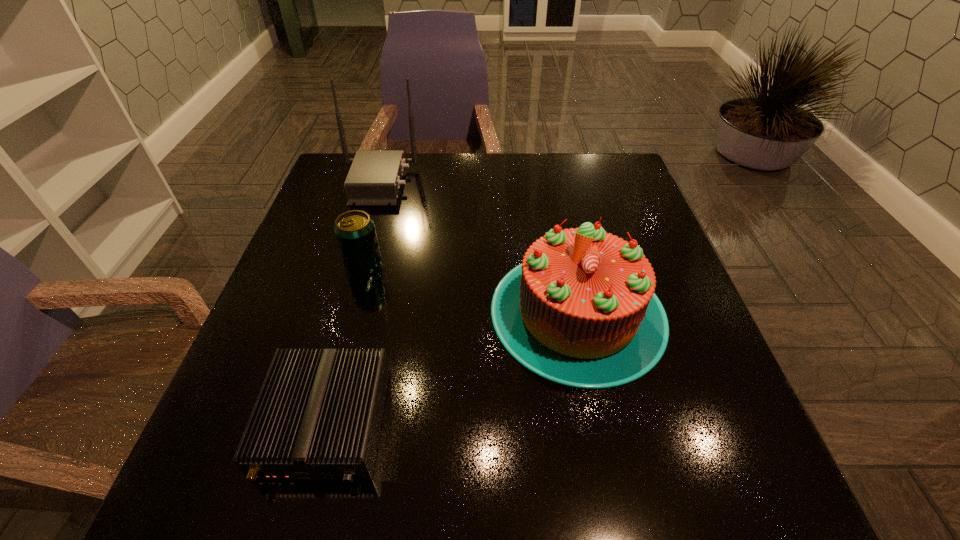
The height and width of the screenshot is (540, 960). Identify the location of the taller router. (374, 179).

Locate an element on the screen. The height and width of the screenshot is (540, 960). the farther router is located at coordinates (374, 179).

Identify the location of the rightmost object. (580, 310).

The image size is (960, 540). In order to click on cake in this screenshot , I will do `click(580, 310)`.

Where is `beer can`? beer can is located at coordinates (355, 232).

I want to click on the shortest object, so click(318, 415).

Image resolution: width=960 pixels, height=540 pixels. I want to click on the nearer router, so click(318, 415).

The width and height of the screenshot is (960, 540). I want to click on free spot located 0.320m on the back of the farther router to connect cables, so click(x=530, y=183).

The height and width of the screenshot is (540, 960). I want to click on vacant point located on the left of the second tallest object, so (x=451, y=312).

This screenshot has height=540, width=960. Identify the location of blank area located 0.270m on the back of the third tallest object. (384, 187).